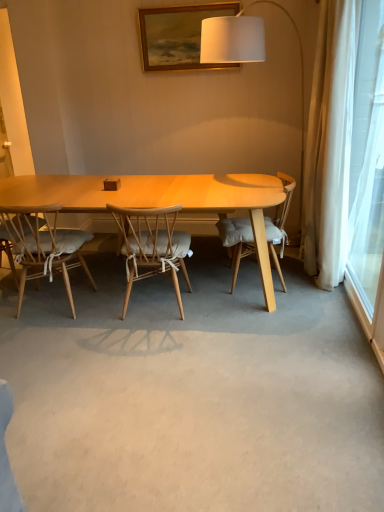
What are the coordinates of `vacant space to the right of light wood chair with white cushion at left, acting as the third chair starting from the right` in the screenshot? It's located at (107, 305).